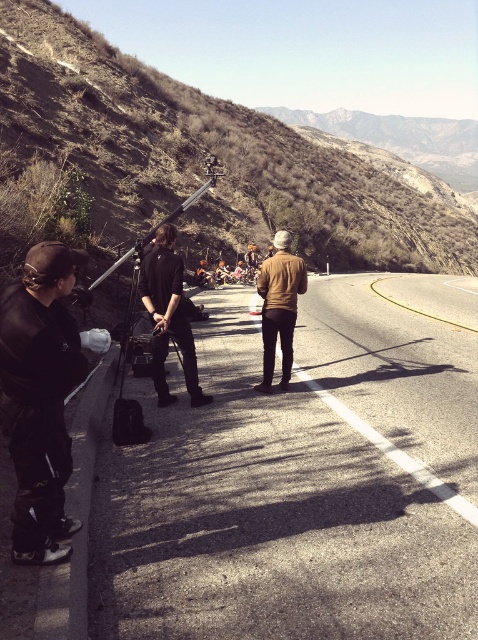
You are a delivery driver who needs to pass through the smooth asphalt highway at center while carrying a large package wrapped in a black leather jacket at center. Can your vehicle safely navigate the highway without the package overhanging the road?

The smooth asphalt highway at center is wider than the black leather jacket at center, so the vehicle can safely navigate the highway without the package overhanging the road.

You are a delivery driver who needs to deliver a package to a customer located on the smooth asphalt highway at center. Your vehicle has a height restriction of 1.8 meters. Can you safely pass under the black leather jacket at center without hitting it?

The smooth asphalt highway at center has a lesser height compared to the black leather jacket at center, so the black leather jacket at center is taller than the highway. Since your vehicle has a height restriction of 1.8 meters, you need to check if the black leather jacket at center is taller than 1.8 meters. However, the exact height of the black leather jacket at center is not provided, so it is uncertain whether the vehicle can pass safely.

You are a hiker who wants to take a photo of the brown leather jacket at center. You are currently standing near the matte black jacket at left. Can you take the photo without moving from your current position?

The matte black jacket at left is closer to the viewer than the brown leather jacket at center, so yes, you can take a photo of the brown leather jacket at center from your current position as long as there is no obstruction between them.